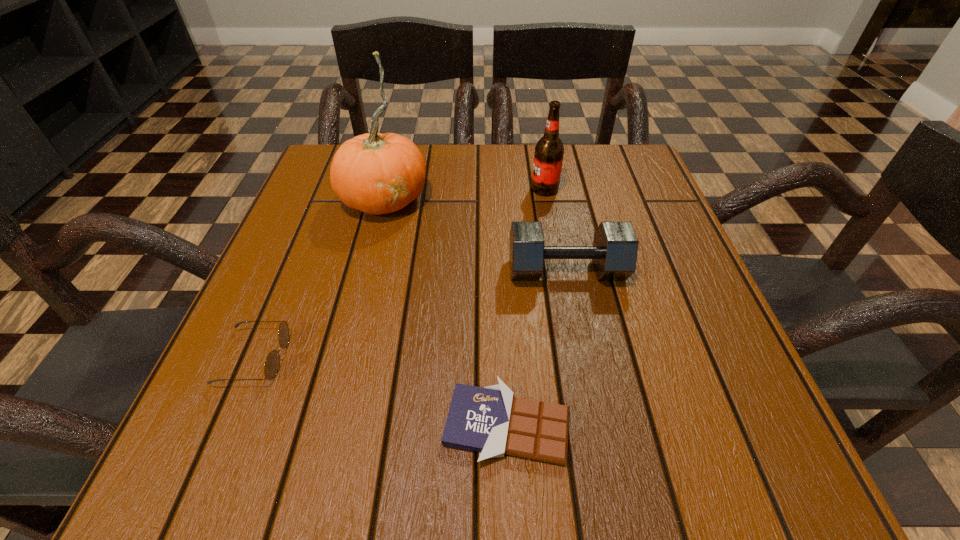
Find the location of a particular element. vacant point located 0.100m on the right of the chocolate bar is located at coordinates click(x=640, y=424).

Locate an element on the screen. The height and width of the screenshot is (540, 960). pumpkin present at the far edge is located at coordinates (375, 173).

Where is `root beer present at the far edge`? The width and height of the screenshot is (960, 540). root beer present at the far edge is located at coordinates coord(549,151).

The image size is (960, 540). In order to click on object present at the near edge in this screenshot , I will do click(x=490, y=420).

Locate an element on the screen. pumpkin that is at the left edge is located at coordinates (375, 173).

Locate an element on the screen. sunglasses that is at the left edge is located at coordinates coord(272,363).

The image size is (960, 540). Find the location of `object that is positioned at the right edge`. object that is positioned at the right edge is located at coordinates (614, 252).

You are a GUI agent. You are given a task and a screenshot of the screen. Output one action in this format:
    pyautogui.click(x=<x>, y=<y>)
    Task: Click on the object situated at the far left corner
    The height and width of the screenshot is (540, 960).
    Given the screenshot: What is the action you would take?
    pyautogui.click(x=375, y=173)

Where is `free region at the far edge of the desktop`? free region at the far edge of the desktop is located at coordinates (469, 178).

Locate an element on the screen. The width and height of the screenshot is (960, 540). vacant space at the left edge of the desktop is located at coordinates (261, 313).